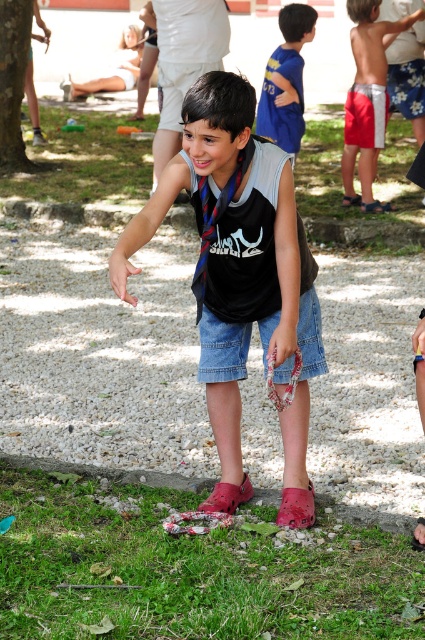
Where is the red cotton shorts at center located in the image?

The red cotton shorts at center is located at point (368, 90) in the image.

You are a parent at the park and see your child wearing the pink croc sandal at lower center. You want to pick it up to put it back on their foot. Where should you move to relative to your current position?

The pink croc sandal at lower center is located at point (226, 497), so you should move towards the lower center area to pick it up.